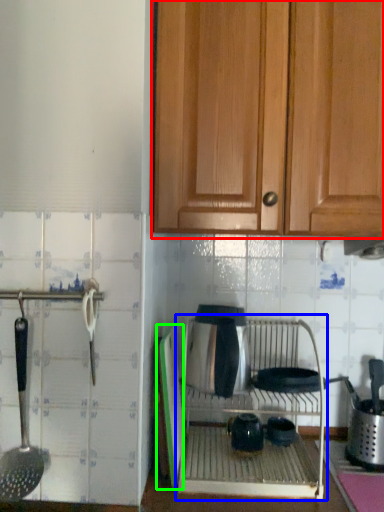
Question: Considering the real-world distances, which object is closest to cabinetry (highlighted by a red box)? oven (highlighted by a blue box) or screen door (highlighted by a green box).

Choices:
 (A) oven
 (B) screen door

Answer: (B)